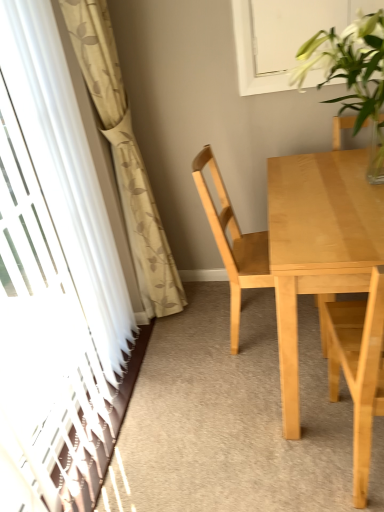
Locate an element on the screen. This screenshot has width=384, height=512. beige floral curtain at left is located at coordinates (124, 155).

The height and width of the screenshot is (512, 384). What do you see at coordinates (359, 369) in the screenshot?
I see `light wood chair at right, which appears as the 2th chair when viewed from the back` at bounding box center [359, 369].

Locate an element on the screen. light wood chair at right, arranged as the first chair when viewed from the front is located at coordinates (359, 369).

I want to click on transparent plastic screen door at left, so click(56, 270).

In order to face transparent plastic screen door at left, should I rotate leftwards or rightwards?

Turn left by 20.074 degrees to look at transparent plastic screen door at left.

The image size is (384, 512). What are the coordinates of `light wood table at center` in the screenshot? It's located at (318, 244).

Find the location of `screen door on the left of light wood table at center`. screen door on the left of light wood table at center is located at coordinates (56, 270).

Consider the image. From a real-world perspective, is transparent plastic screen door at left over light wood table at center?

Yes, from a real-world perspective, transparent plastic screen door at left is over light wood table at center

Between transparent plastic screen door at left and light wood table at center, which one is positioned behind?

light wood table at center is more distant.

From the image's perspective, relative to light wood table at center, is white glossy window at upper center above or below?

Based on their image positions, white glossy window at upper center is located above light wood table at center.

Considering the positions of objects white glossy window at upper center and light wood table at center in the image provided, who is more to the right, white glossy window at upper center or light wood table at center?

From the viewer's perspective, light wood table at center appears more on the right side.

Considering the positions of point (237, 40) and point (284, 204), is point (237, 40) closer or farther from the camera than point (284, 204)?

Point (237, 40) is positioned farther from the camera compared to point (284, 204).

Is white glossy window at upper center facing away from light wood table at center?

That's not correct — white glossy window at upper center is not looking away from light wood table at center.

Is transparent plastic screen door at left to the right of white glossy window at upper center from the viewer's perspective?

No.

Is white glossy window at upper center at the back of transparent plastic screen door at left?

transparent plastic screen door at left is not turned away from white glossy window at upper center.

From the image's perspective, is transparent plastic screen door at left above or below white glossy window at upper center?

Clearly, from the image's perspective, transparent plastic screen door at left is below white glossy window at upper center.

From a real-world perspective, which object stands above the other?

In real-world perspective, white glossy window at upper center is above.

Does light wood chair at center, which is the second chair from front to back, have a larger size compared to light wood chair at right, which appears as the 2th chair when viewed from the back?

Correct, light wood chair at center, which is the second chair from front to back, is larger in size than light wood chair at right, which appears as the 2th chair when viewed from the back.

Who is taller, light wood chair at center, marked as the 1th chair in a back-to-front arrangement, or light wood chair at right, which appears as the 2th chair when viewed from the back?

light wood chair at center, marked as the 1th chair in a back-to-front arrangement, is taller.

From a real-world perspective, who is located higher, light wood chair at center, which is the second chair from front to back, or light wood chair at right, arranged as the first chair when viewed from the front?

light wood chair at center, which is the second chair from front to back, is physically above.

In terms of height, does beige floral curtain at left look taller or shorter compared to light wood chair at center, marked as the 1th chair in a back-to-front arrangement?

beige floral curtain at left is taller than light wood chair at center, marked as the 1th chair in a back-to-front arrangement.

In terms of size, does beige floral curtain at left appear bigger or smaller than light wood chair at center, marked as the 1th chair in a back-to-front arrangement?

Considering their sizes, beige floral curtain at left takes up less space than light wood chair at center, marked as the 1th chair in a back-to-front arrangement.

Is the position of beige floral curtain at left less distant than that of light wood chair at center, marked as the 1th chair in a back-to-front arrangement?

Yes, the depth of beige floral curtain at left is less than that of light wood chair at center, marked as the 1th chair in a back-to-front arrangement.

Is beige floral curtain at left far away from light wood chair at center, marked as the 1th chair in a back-to-front arrangement?

No, beige floral curtain at left is not far from light wood chair at center, marked as the 1th chair in a back-to-front arrangement.

From a real-world perspective, relative to beige floral curtain at left, is clear glass vase at upper right vertically above or below?

In terms of real-world spatial position, clear glass vase at upper right is above beige floral curtain at left.

Is clear glass vase at upper right spatially inside beige floral curtain at left, or outside of it?

clear glass vase at upper right is not enclosed by beige floral curtain at left.

Does clear glass vase at upper right have a lesser height compared to beige floral curtain at left?

Correct, clear glass vase at upper right is not as tall as beige floral curtain at left.

From the image's perspective, who appears lower, clear glass vase at upper right or beige floral curtain at left?

beige floral curtain at left, from the image's perspective.

Does white glossy window at upper center have a lesser width compared to clear glass vase at upper right?

Yes.

Is white glossy window at upper center closer to the viewer compared to clear glass vase at upper right?

No, white glossy window at upper center is further to the viewer.

Is white glossy window at upper center placed right next to clear glass vase at upper right?

No, white glossy window at upper center is not touching clear glass vase at upper right.

The width and height of the screenshot is (384, 512). In order to click on screen door on the left of light wood table at center in this screenshot , I will do `click(56, 270)`.

The height and width of the screenshot is (512, 384). In the image, there is a white glossy window at upper center. What are the coordinates of `kitchen & dining room table below it (from the image's perspective)` in the screenshot? It's located at (318, 244).

When comparing their distances from transparent plastic screen door at left, does light wood chair at center, marked as the 1th chair in a back-to-front arrangement, or white glossy window at upper center seem further?

The object further to transparent plastic screen door at left is white glossy window at upper center.

Which object lies further to the anchor point clear glass vase at upper right, beige floral curtain at left or white glossy window at upper center?

beige floral curtain at left is further to clear glass vase at upper right.

Based on their spatial positions, is transparent plastic screen door at left or beige floral curtain at left closer to clear glass vase at upper right?

beige floral curtain at left.

Looking at the image, which one is located further to white glossy window at upper center, beige floral curtain at left or light wood chair at right, arranged as the first chair when viewed from the front?

light wood chair at right, arranged as the first chair when viewed from the front.

Considering their positions, is beige floral curtain at left positioned closer to transparent plastic screen door at left than white glossy window at upper center?

Among the two, beige floral curtain at left is located nearer to transparent plastic screen door at left.

Estimate the real-world distances between objects in this image. Which object is closer to light wood chair at right, arranged as the first chair when viewed from the front, light wood table at center or beige floral curtain at left?

light wood table at center.

Based on their spatial positions, is transparent plastic screen door at left or light wood chair at center, which is the second chair from front to back, further from light wood table at center?

transparent plastic screen door at left.

Estimate the real-world distances between objects in this image. Which object is closer to light wood table at center, light wood chair at center, which is the second chair from front to back, or transparent plastic screen door at left?

light wood chair at center, which is the second chair from front to back, is closer to light wood table at center.

Find the location of a particular element. The height and width of the screenshot is (512, 384). chair between white glossy window at upper center and light wood chair at right, which appears as the 2th chair when viewed from the back, vertically is located at coordinates (232, 242).

Where is `houseplant between transparent plastic screen door at left and light wood table at center`? The width and height of the screenshot is (384, 512). houseplant between transparent plastic screen door at left and light wood table at center is located at coordinates (352, 75).

Locate an element on the screen. Image resolution: width=384 pixels, height=512 pixels. chair between beige floral curtain at left and light wood chair at right, arranged as the first chair when viewed from the front, from left to right is located at coordinates (232, 242).

Image resolution: width=384 pixels, height=512 pixels. I want to click on window between beige floral curtain at left and clear glass vase at upper right from left to right, so click(277, 37).